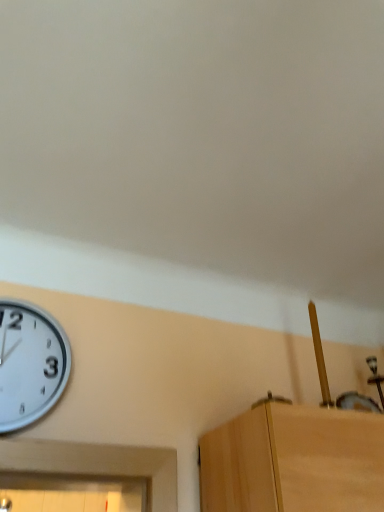
This screenshot has height=512, width=384. What do you see at coordinates (30, 364) in the screenshot? I see `white metallic clock at left` at bounding box center [30, 364].

You are a GUI agent. You are given a task and a screenshot of the screen. Output one action in this format:
    pyautogui.click(x=<x>, y=<y>)
    Task: Click on the white metallic clock at left
    The height and width of the screenshot is (512, 384).
    Given the screenshot: What is the action you would take?
    pyautogui.click(x=30, y=364)

Identify the location of white metallic clock at left. The height and width of the screenshot is (512, 384). (30, 364).